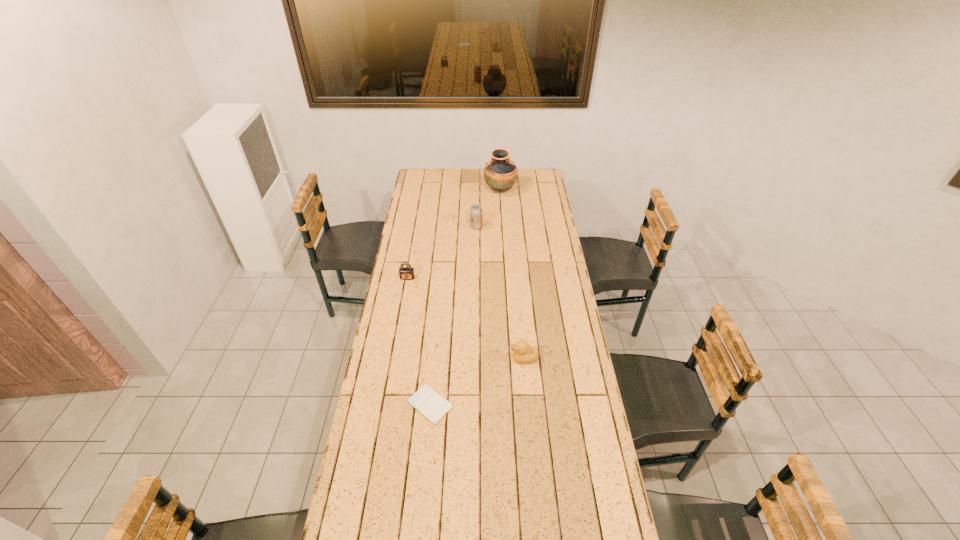
Find the location of a particular element. free space at the left edge of the desktop is located at coordinates (410, 418).

Locate an element on the screen. free space at the right edge of the desktop is located at coordinates (541, 206).

Image resolution: width=960 pixels, height=540 pixels. In the image, there is a desktop. In order to click on vacant space at the far left corner in this screenshot , I will do `click(421, 169)`.

Where is `vacant area that lies between the padlock and the fourth farthest object`? The width and height of the screenshot is (960, 540). vacant area that lies between the padlock and the fourth farthest object is located at coordinates (466, 318).

You are a GUI agent. You are given a task and a screenshot of the screen. Output one action in this format:
    pyautogui.click(x=<x>, y=<y>)
    Task: Click on the free area in between the pottery and the nearest object
    
    Given the screenshot: What is the action you would take?
    pyautogui.click(x=466, y=298)

Image resolution: width=960 pixels, height=540 pixels. Identify the location of empty space between the calculator and the duckling. (477, 381).

Locate an element on the screen. This screenshot has width=960, height=540. free area in between the tallest object and the duckling is located at coordinates (512, 274).

You are a GUI agent. You are given a task and a screenshot of the screen. Output one action in this format:
    pyautogui.click(x=<x>, y=<y>)
    Task: Click on the unoccupied area between the farthest object and the duckling
    Image resolution: width=960 pixels, height=540 pixels.
    Given the screenshot: What is the action you would take?
    (512, 274)

This screenshot has width=960, height=540. Identify the location of vacant region between the third nearest object and the shortest object. (419, 341).

You are a GUI agent. You are given a task and a screenshot of the screen. Output one action in this format:
    pyautogui.click(x=<x>, y=<y>)
    Task: Click on the blank region between the nearest object and the third nearest object
    The image size is (960, 540).
    Given the screenshot: What is the action you would take?
    pyautogui.click(x=419, y=341)